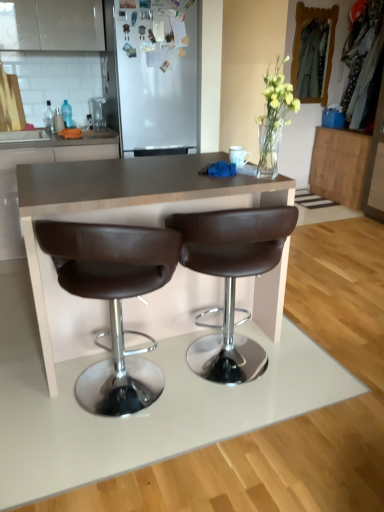
The width and height of the screenshot is (384, 512). Identify the location of free space to the right of brown leather stool at center, positioned as the first chair in left-to-right order. (236, 429).